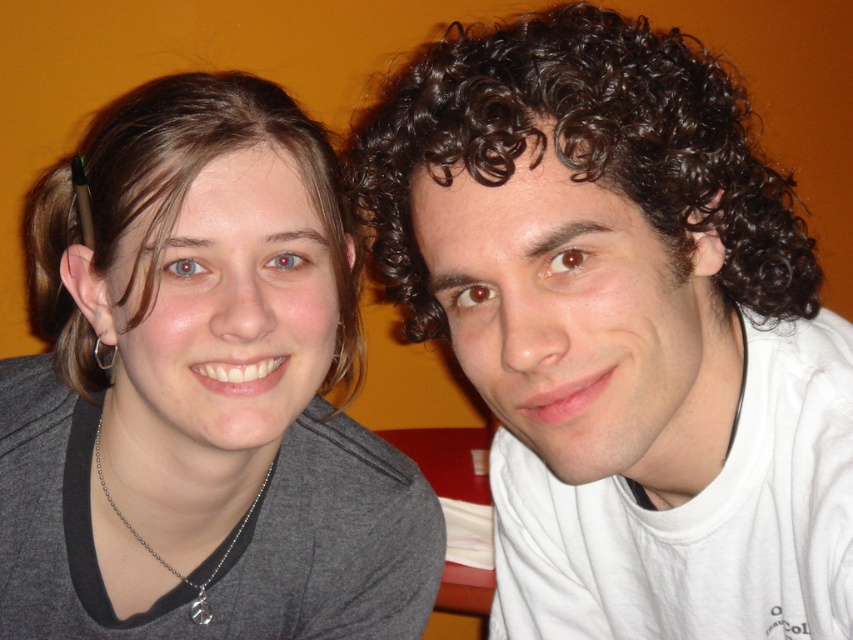
Question: Which point is farther from the camera taking this photo?

Choices:
 (A) (750, 621)
 (B) (241, 106)
 (C) (363, 524)

Answer: (C)

Question: Which object appears farthest from the camera in this image?

Choices:
 (A) gray fabric at left
 (B) brown smooth hair at left

Answer: (B)

Question: Does dark brown curly hair at center appear on the right side of gray fabric at left?

Choices:
 (A) no
 (B) yes

Answer: (B)

Question: Does dark brown curly hair at center have a lesser width compared to gray fabric at left?

Choices:
 (A) yes
 (B) no

Answer: (A)

Question: Does dark brown curly hair at center have a lesser width compared to brown smooth hair at left?

Choices:
 (A) no
 (B) yes

Answer: (A)

Question: Which point appears closest to the camera in this image?

Choices:
 (A) (51, 259)
 (B) (498, 250)
 (C) (86, 506)

Answer: (B)